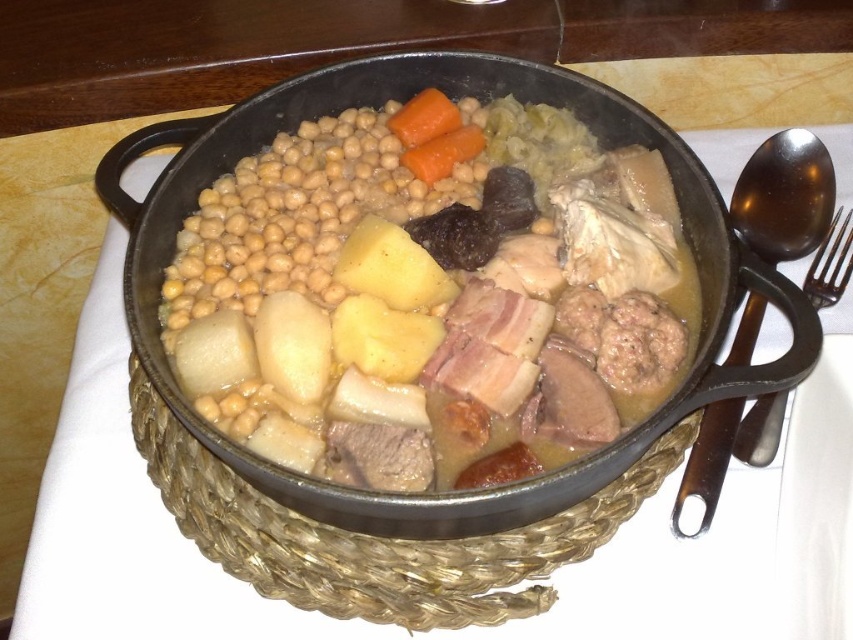
Which is in front, point (534, 260) or point (735, 216)?

Point (534, 260) is more forward.

What do you see at coordinates (431, 296) in the screenshot? The height and width of the screenshot is (640, 853). I see `golden brown stew at center` at bounding box center [431, 296].

Between point (581, 163) and point (753, 333), which one is positioned in front?

Positioned in front is point (753, 333).

Where is `golden brown stew at center`? This screenshot has height=640, width=853. golden brown stew at center is located at coordinates (431, 296).

Can you confirm if golden brown stew at center is smaller than black metal fork at right?

Actually, golden brown stew at center might be larger than black metal fork at right.

Between golden brown stew at center and black metal fork at right, which one has more height?

golden brown stew at center

Where is `golden brown stew at center`? golden brown stew at center is located at coordinates (431, 296).

Which of these two, shiny metal spoon at right or black metal fork at right, stands shorter?

black metal fork at right

Can you confirm if shiny metal spoon at right is shorter than black metal fork at right?

No, shiny metal spoon at right is not shorter than black metal fork at right.

Where is `shiny metal spoon at right`? Image resolution: width=853 pixels, height=640 pixels. shiny metal spoon at right is located at coordinates (784, 196).